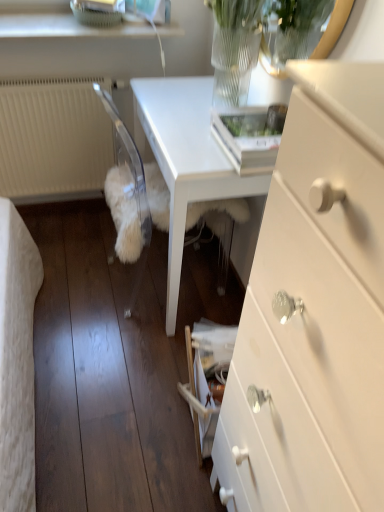
Locate an element on the screen. Image resolution: width=384 pixels, height=512 pixels. free space on the front side of white glossy table at center is located at coordinates [x=120, y=371].